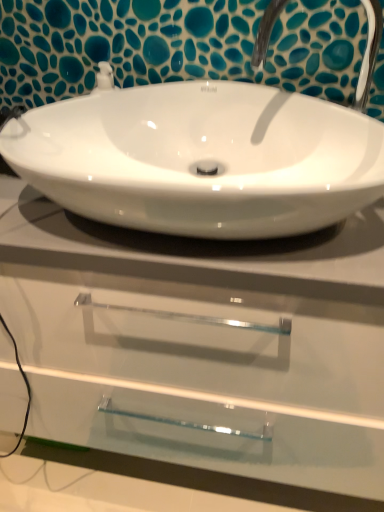
Question: From a real-world perspective, is satin nickel faucet at upper center physically located above or below white glossy sink at center?

Choices:
 (A) below
 (B) above

Answer: (B)

Question: Is satin nickel faucet at upper center bigger or smaller than white glossy sink at center?

Choices:
 (A) small
 (B) big

Answer: (A)

Question: Which object is the farthest from the white glossy sink at center?

Choices:
 (A) white glossy countertop at center
 (B) satin nickel faucet at upper center

Answer: (A)

Question: Based on their relative distances, which object is nearer to the white glossy countertop at center?

Choices:
 (A) white glossy sink at center
 (B) satin nickel faucet at upper center

Answer: (A)